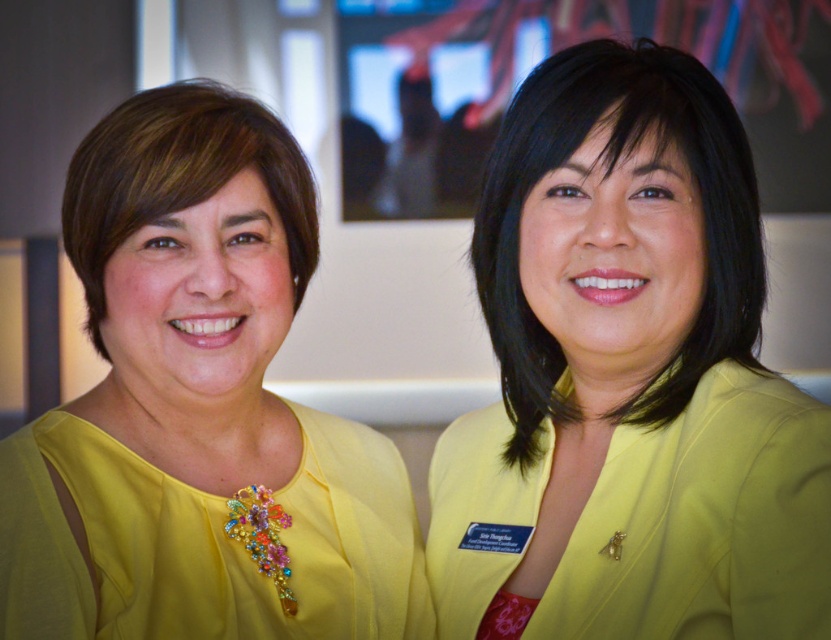
Question: Which point is closer to the camera?

Choices:
 (A) (171, 227)
 (B) (660, 627)

Answer: (B)

Question: Does matte yellow blazer at center have a lesser width compared to yellow satin blouse at left?

Choices:
 (A) no
 (B) yes

Answer: (B)

Question: Considering the relative positions of matte yellow blazer at center and yellow satin blouse at left in the image provided, where is matte yellow blazer at center located with respect to yellow satin blouse at left?

Choices:
 (A) above
 (B) below

Answer: (A)

Question: Among these objects, which one is nearest to the camera?

Choices:
 (A) matte yellow blazer at center
 (B) yellow satin blouse at left

Answer: (A)

Question: Can you confirm if matte yellow blazer at center is positioned to the left of yellow satin blouse at left?

Choices:
 (A) yes
 (B) no

Answer: (B)